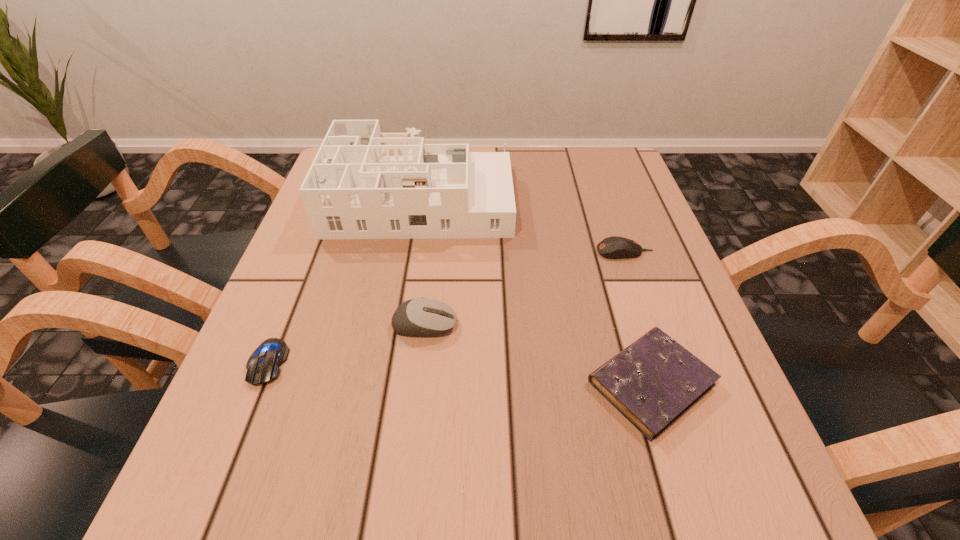
Locate an element on the screen. vacant area in the image that satisfies the following two spatial constraints: 1. on the back side of the diary; 2. on the wheel side of the second computer mouse from right to left is located at coordinates click(x=633, y=325).

Locate an element on the screen. blank space that satisfies the following two spatial constraints: 1. on the wheel side of the tallest computer mouse; 2. on the left side of the diary is located at coordinates (418, 383).

The width and height of the screenshot is (960, 540). What are the coordinates of `vacant space that satisfies the following two spatial constraints: 1. on the button side of the shortest computer mouse; 2. on the left side of the diary` in the screenshot? It's located at (259, 383).